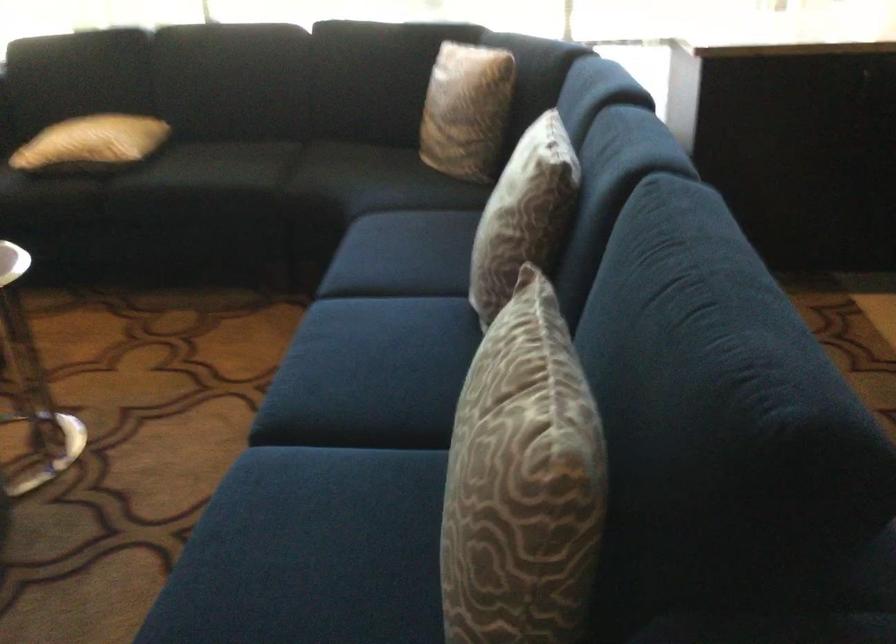
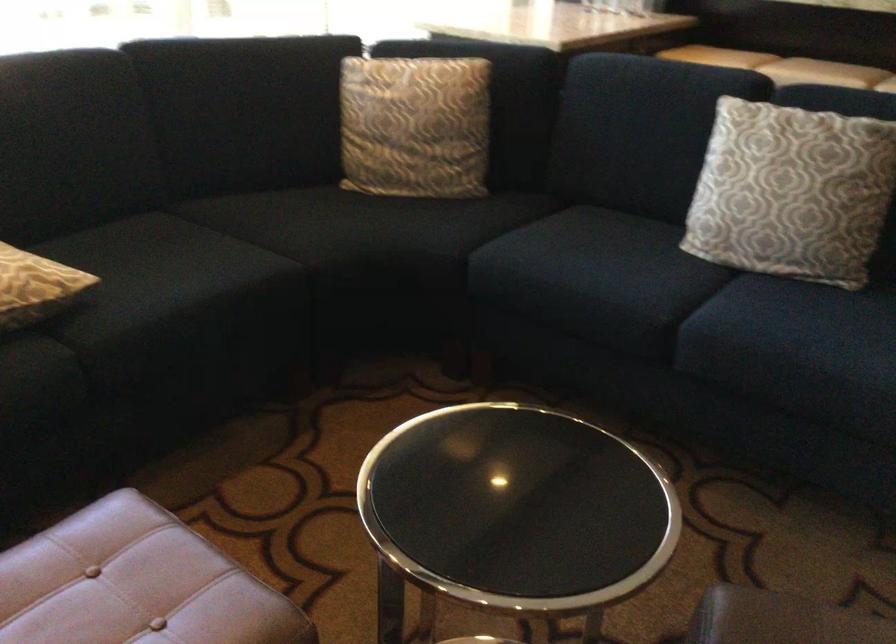
The point at (201, 166) is marked in the first image. Where is the corresponding point in the second image?

(161, 270)